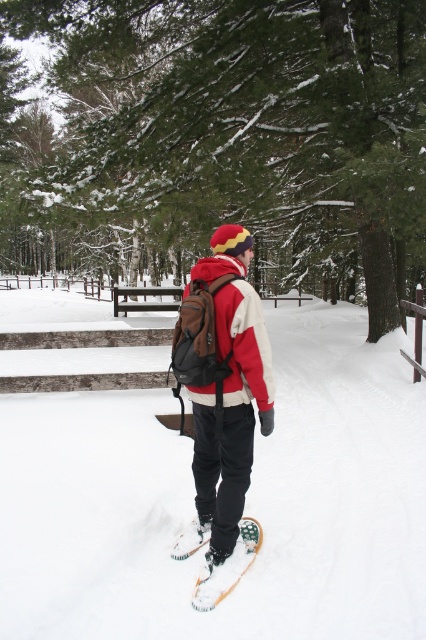
Question: Is white fluffy snow at center bigger than matte brown backpack at center?

Choices:
 (A) yes
 (B) no

Answer: (A)

Question: Considering the real-world distances, which object is closest to the red fleece jacket at center?

Choices:
 (A) matte brown backpack at center
 (B) green textured tree at center
 (C) green rubber snowboard at lower center

Answer: (A)

Question: Does white fluffy snow at center come behind matte brown backpack at center?

Choices:
 (A) no
 (B) yes

Answer: (A)

Question: Is matte brown backpack at center above red fleece jacket at center?

Choices:
 (A) no
 (B) yes

Answer: (A)

Question: Which object appears closest to the camera in this image?

Choices:
 (A) green textured tree at center
 (B) white fluffy snow at center

Answer: (B)

Question: Which is farther from the red fleece jacket at center?

Choices:
 (A) white fluffy snow at center
 (B) green textured tree at center
 (C) matte brown backpack at center

Answer: (B)